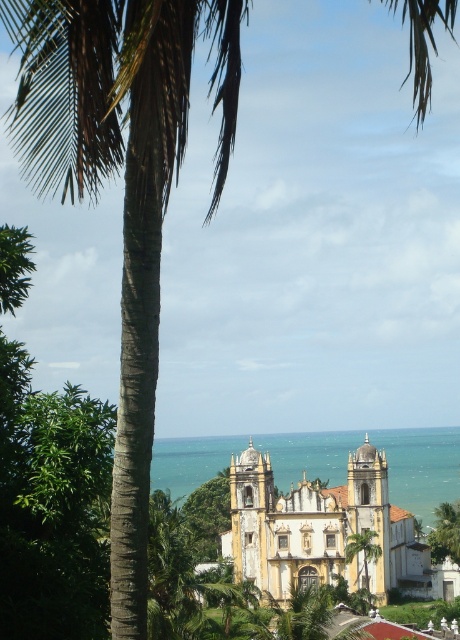
Does yellow matte church at center appear on the left side of blue water at center?

No, yellow matte church at center is not to the left of blue water at center.

Does yellow matte church at center lie in front of blue water at center?

Yes, it is.

The image size is (460, 640). I want to click on yellow matte church at center, so point(322,529).

Find the location of a particular element. The image size is (460, 640). yellow matte church at center is located at coordinates tap(322, 529).